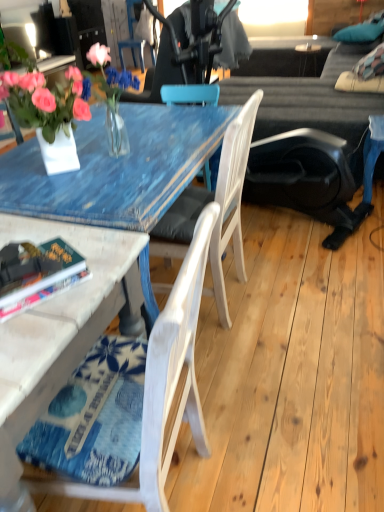
Question: Would you say hardcover book at lower left is a long distance from dark gray fabric couch at upper right?

Choices:
 (A) yes
 (B) no

Answer: (A)

Question: From the image's perspective, would you say hardcover book at lower left is shown under dark gray fabric couch at upper right?

Choices:
 (A) yes
 (B) no

Answer: (A)

Question: Is hardcover book at lower left positioned in front of dark gray fabric couch at upper right?

Choices:
 (A) no
 (B) yes

Answer: (B)

Question: Considering the relative sizes of hardcover book at lower left and dark gray fabric couch at upper right in the image provided, is hardcover book at lower left taller than dark gray fabric couch at upper right?

Choices:
 (A) no
 (B) yes

Answer: (A)

Question: Is hardcover book at lower left completely or partially outside of dark gray fabric couch at upper right?

Choices:
 (A) yes
 (B) no

Answer: (A)

Question: Considering the relative positions of translucent glass vase at upper left and dark gray fabric couch at upper right in the image provided, is translucent glass vase at upper left to the left or to the right of dark gray fabric couch at upper right?

Choices:
 (A) right
 (B) left

Answer: (B)

Question: In the image, is translucent glass vase at upper left positioned in front of or behind dark gray fabric couch at upper right?

Choices:
 (A) behind
 (B) front

Answer: (B)

Question: Considering the positions of translucent glass vase at upper left and dark gray fabric couch at upper right in the image, is translucent glass vase at upper left taller or shorter than dark gray fabric couch at upper right?

Choices:
 (A) short
 (B) tall

Answer: (A)

Question: From a real-world perspective, is translucent glass vase at upper left above or below dark gray fabric couch at upper right?

Choices:
 (A) above
 (B) below

Answer: (A)

Question: From the image's perspective, is white wood chair at center, which is the 2th chair from front to back, above or below dark gray fabric couch at upper right?

Choices:
 (A) above
 (B) below

Answer: (B)

Question: From a real-world perspective, relative to dark gray fabric couch at upper right, is white wood chair at center, positioned as the second chair in top-to-bottom order, vertically above or below?

Choices:
 (A) below
 (B) above

Answer: (B)

Question: Considering the positions of white wood chair at center, which is counted as the 2th chair, starting from the back, and dark gray fabric couch at upper right in the image, is white wood chair at center, which is counted as the 2th chair, starting from the back, taller or shorter than dark gray fabric couch at upper right?

Choices:
 (A) short
 (B) tall

Answer: (B)

Question: Considering the positions of point (225, 317) and point (362, 130), is point (225, 317) closer or farther from the camera than point (362, 130)?

Choices:
 (A) farther
 (B) closer

Answer: (B)

Question: Based on their positions, is dark gray fabric couch at upper right located to the left or right of translucent glass vase at upper left?

Choices:
 (A) left
 (B) right

Answer: (B)

Question: Is dark gray fabric couch at upper right taller or shorter than translucent glass vase at upper left?

Choices:
 (A) short
 (B) tall

Answer: (B)